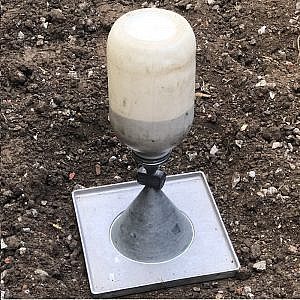
The width and height of the screenshot is (300, 300). In order to click on stand in this screenshot , I will do `click(198, 252)`.